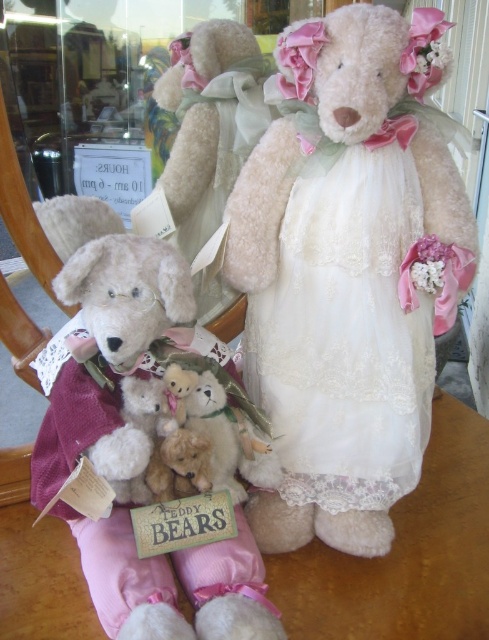
You are a customer in the store looking at the teddy bears. You want to know which item is taller between the white lace dress at center and the fluffy white teddy bear at center. Can you tell me?

The white lace dress at center is taller than the fluffy white teddy bear at center.

You are a customer looking at the shop window. The large teddy bear in the center is dressed in a white lace dress. Can you tell me the exact position of the white lace dress at center in the image?

The white lace dress at center is located at point 0.505 in the x coordinate and 0.689 in the y coordinate.

You are standing in front of the teddy bear display and want to reach the point at coordinates point (303, 369). If your arm can extend 28 inches, will you be able to touch that point?

The distance between point (303, 369) and the viewer is 29.22 inches. Since your arm can only extend 28 inches, you cannot reach that point.